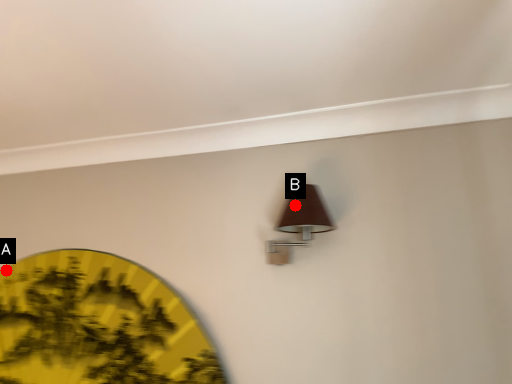
Question: Two points are circled on the image, labeled by A and B beside each circle. Which point is farther from the camera taking this photo?

Choices:
 (A) A is further
 (B) B is further

Answer: (A)